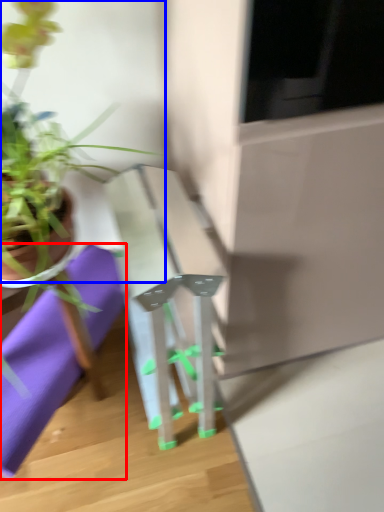
Question: Among these objects, which one is nearest to the camera, cloth (highlighted by a red box) or houseplant (highlighted by a blue box)?

Choices:
 (A) cloth
 (B) houseplant

Answer: (B)